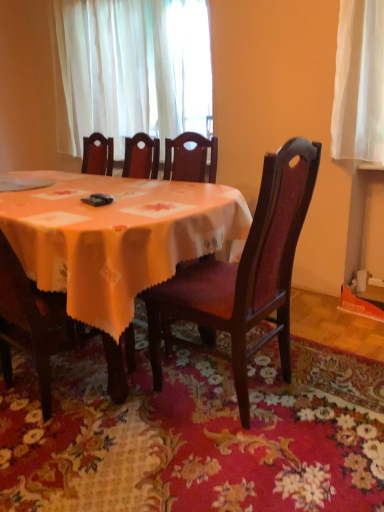
Question: Considering the positions of point (6, 302) and point (292, 138), is point (6, 302) closer or farther from the camera than point (292, 138)?

Choices:
 (A) closer
 (B) farther

Answer: (B)

Question: Is wooden chair at center, the first chair when ordered from left to right, taller or shorter than matte wood chair at center, which appears as the second chair when viewed from the left?

Choices:
 (A) short
 (B) tall

Answer: (A)

Question: Considering the real-world distances, which object is farthest from the floral carpet at lower center?

Choices:
 (A) matte wood chair at center, which appears as the second chair when viewed from the left
 (B) wooden chair at center, the 2th chair when ordered from right to left
 (C) white glossy plate at upper left
 (D) white sheer curtain at upper center
 (E) matte orange tablecloth at center

Answer: (D)

Question: Based on their relative distances, which object is nearer to the wooden chair at center, the 2th chair when ordered from right to left?

Choices:
 (A) white sheer curtain at upper center
 (B) white glossy plate at upper left
 (C) matte orange tablecloth at center
 (D) matte wood chair at center, which is the first chair in right-to-left order
 (E) floral carpet at lower center

Answer: (C)